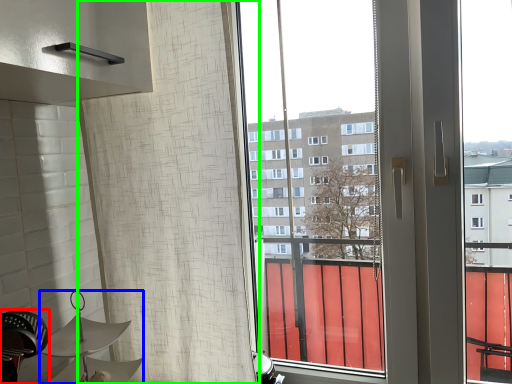
Question: Estimate the real-world distances between objects in this image. Which object is farther from swivel chair (highlighted by a red box), lamp (highlighted by a blue box) or shower curtain (highlighted by a green box)?

Choices:
 (A) lamp
 (B) shower curtain

Answer: (B)